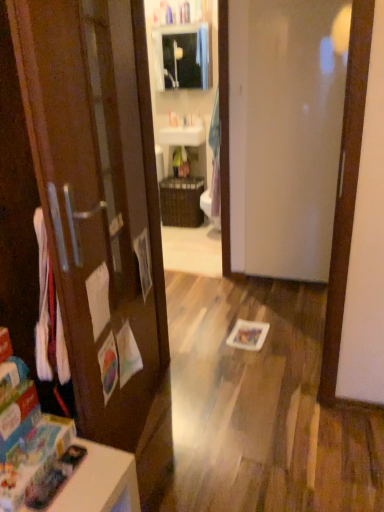
Question: Visually, is white glossy sink at upper center positioned to the left or to the right of matte glass medicine cabinet at upper center?

Choices:
 (A) left
 (B) right

Answer: (B)

Question: From the image's perspective, is white glossy sink at upper center located above or below matte glass medicine cabinet at upper center?

Choices:
 (A) above
 (B) below

Answer: (B)

Question: Estimate the real-world distances between objects in this image. Which object is closer to the white glossy door at center?

Choices:
 (A) white glossy sink at upper center
 (B) white glossy table at lower left
 (C) matte glass medicine cabinet at upper center
 (D) white plastic sink at upper center

Answer: (A)

Question: Which object is the closest to the white glossy sink at upper center?

Choices:
 (A) white glossy table at lower left
 (B) matte glass medicine cabinet at upper center
 (C) white plastic sink at upper center
 (D) white glossy door at center

Answer: (C)